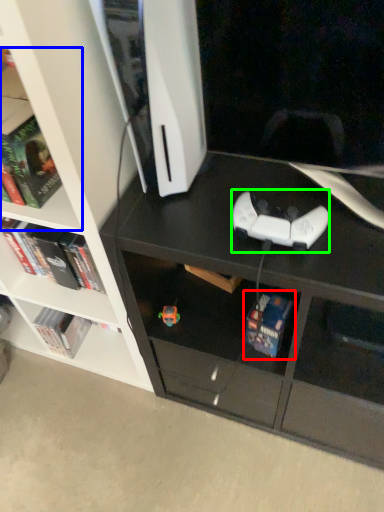
Question: Estimate the real-world distances between objects in this image. Which object is farther from book (highlighted by a red box), shelf (highlighted by a blue box) or game controller (highlighted by a green box)?

Choices:
 (A) shelf
 (B) game controller

Answer: (A)